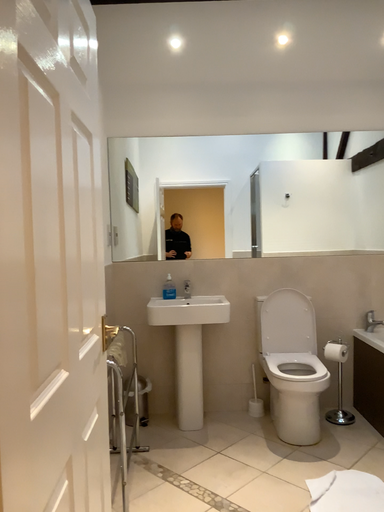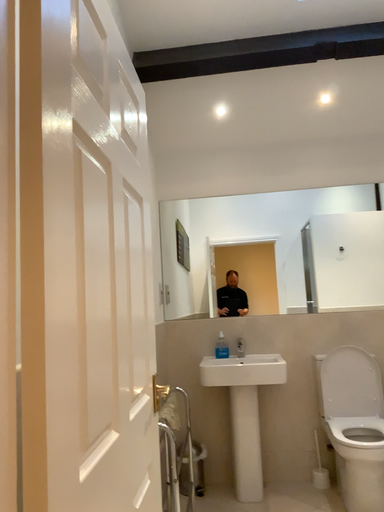
Question: How did the camera likely rotate when shooting the video?

Choices:
 (A) rotated left
 (B) rotated right

Answer: (A)